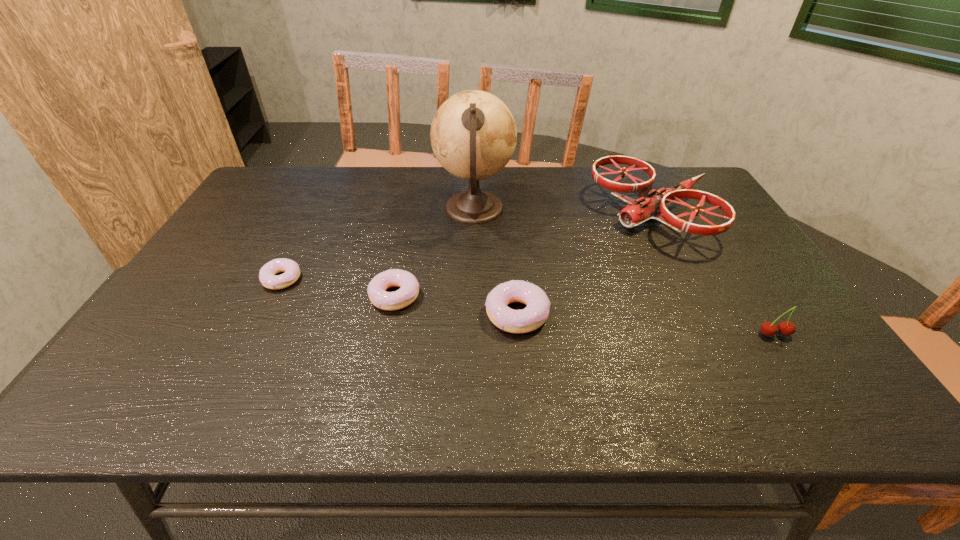
Select which doughnut is the closest to the fifth shortest object. Please provide its 2D coordinates. Your answer should be formatted as a tuple, i.e. [(x, y)], where the tuple contains the x and y coordinates of a point satisfying the conditions above.

[(534, 315)]

The image size is (960, 540). What are the coordinates of `doughnut that stands as the second closest to the leftmost object` in the screenshot? It's located at (534, 315).

I want to click on free point that satisfies the following two spatial constraints: 1. on the front-facing side of the drone; 2. on the right side of the globe, so click(x=474, y=216).

This screenshot has width=960, height=540. I want to click on vacant area that satisfies the following two spatial constraints: 1. on the back side of the fifth shortest object; 2. on the front-facing side of the tallest object, so click(651, 209).

The width and height of the screenshot is (960, 540). In order to click on free location that satisfies the following two spatial constraints: 1. on the front side of the leftmost doughnut; 2. on the left side of the tallest doughnut in this screenshot , I will do `click(264, 314)`.